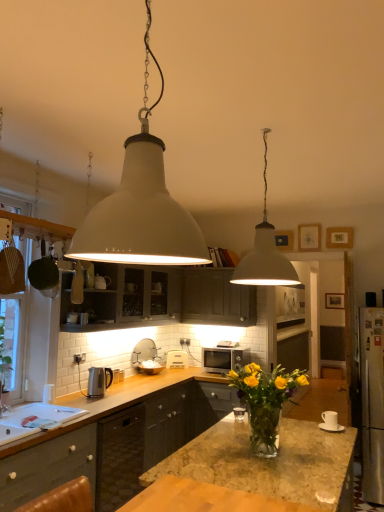
This screenshot has height=512, width=384. Identify the location of spots to the right of polished stainless steel kettle at lower left, the 2th appliance positioned from the bottom. (127, 394).